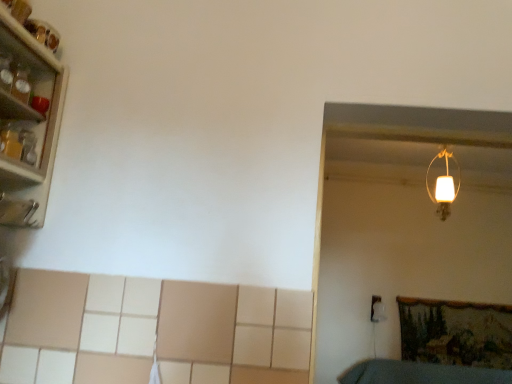
Question: Is metallic glassware at left turned away from white matte lampshade at upper right?

Choices:
 (A) yes
 (B) no

Answer: (B)

Question: Considering the relative sizes of metallic glassware at left and white matte lampshade at upper right in the image provided, is metallic glassware at left wider than white matte lampshade at upper right?

Choices:
 (A) no
 (B) yes

Answer: (B)

Question: Is metallic glassware at left beside white matte lampshade at upper right?

Choices:
 (A) no
 (B) yes

Answer: (A)

Question: Does metallic glassware at left appear on the left side of white matte lampshade at upper right?

Choices:
 (A) no
 (B) yes

Answer: (B)

Question: Does metallic glassware at left appear on the right side of white matte lampshade at upper right?

Choices:
 (A) no
 (B) yes

Answer: (A)

Question: From a real-world perspective, is metallic glassware at left on top of white matte lampshade at upper right?

Choices:
 (A) yes
 (B) no

Answer: (B)

Question: Is white matte lampshade at upper right taller than metallic glassware at left?

Choices:
 (A) no
 (B) yes

Answer: (B)

Question: Can you confirm if white matte lampshade at upper right is positioned to the left of metallic glassware at left?

Choices:
 (A) yes
 (B) no

Answer: (B)

Question: Considering the relative positions of white matte lampshade at upper right and metallic glassware at left in the image provided, is white matte lampshade at upper right to the right of metallic glassware at left from the viewer's perspective?

Choices:
 (A) yes
 (B) no

Answer: (A)

Question: Considering the relative sizes of white matte lampshade at upper right and metallic glassware at left in the image provided, is white matte lampshade at upper right smaller than metallic glassware at left?

Choices:
 (A) no
 (B) yes

Answer: (B)

Question: From a real-world perspective, is white matte lampshade at upper right on top of metallic glassware at left?

Choices:
 (A) yes
 (B) no

Answer: (A)

Question: Is white matte lampshade at upper right next to metallic glassware at left?

Choices:
 (A) yes
 (B) no

Answer: (B)

Question: From the image's perspective, relative to metallic glassware at left, is white matte lampshade at upper right above or below?

Choices:
 (A) below
 (B) above

Answer: (A)